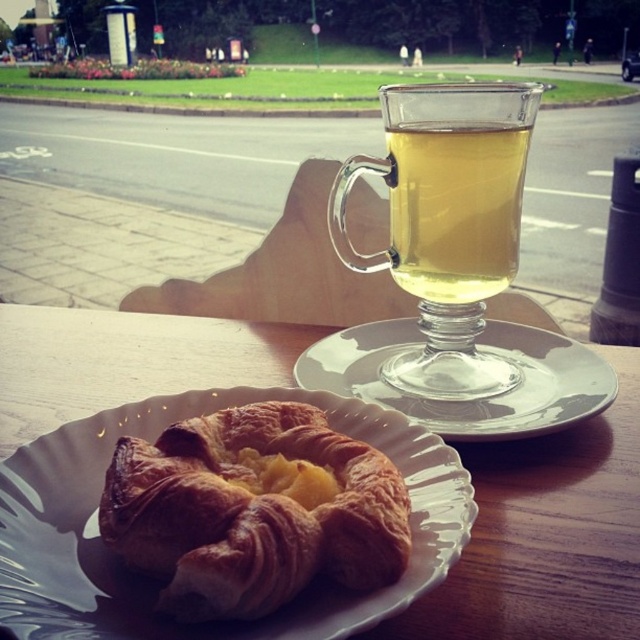
Question: Can you confirm if wooden table at center is positioned below golden flaky croissant at lower left?

Choices:
 (A) no
 (B) yes

Answer: (A)

Question: Is transparent glass mug at center above transparent glass cup at upper center?

Choices:
 (A) no
 (B) yes

Answer: (A)

Question: Where is wooden table at center located in relation to transparent glass saucer at center in the image?

Choices:
 (A) right
 (B) left

Answer: (B)

Question: Which object is positioned closest to the wooden table at center?

Choices:
 (A) golden flaky croissant at lower left
 (B) golden brown flaky croissant at lower left

Answer: (B)

Question: Which is nearer to the transparent glass cup at upper center?

Choices:
 (A) transparent glass saucer at center
 (B) wooden table at center

Answer: (A)

Question: Which object is the farthest from the golden flaky croissant at lower left?

Choices:
 (A) wooden table at center
 (B) transparent glass cup at upper center
 (C) transparent glass saucer at center
 (D) transparent glass mug at center

Answer: (A)